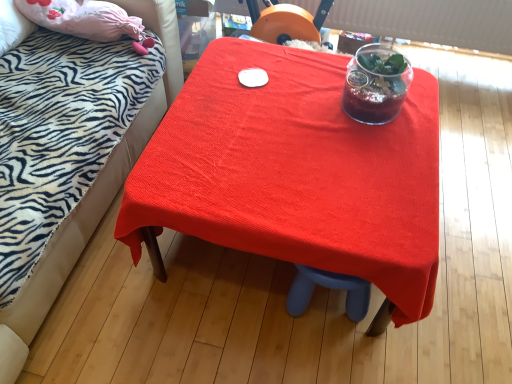
This screenshot has width=512, height=384. I want to click on free location above smooth red tablecloth at center (from a real-world perspective), so click(x=291, y=151).